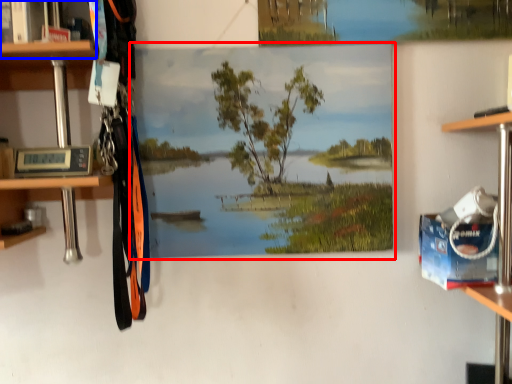
Question: Among these objects, which one is nearest to the camera, oil painting (highlighted by a red box) or cabinet (highlighted by a blue box)?

Choices:
 (A) oil painting
 (B) cabinet

Answer: (B)